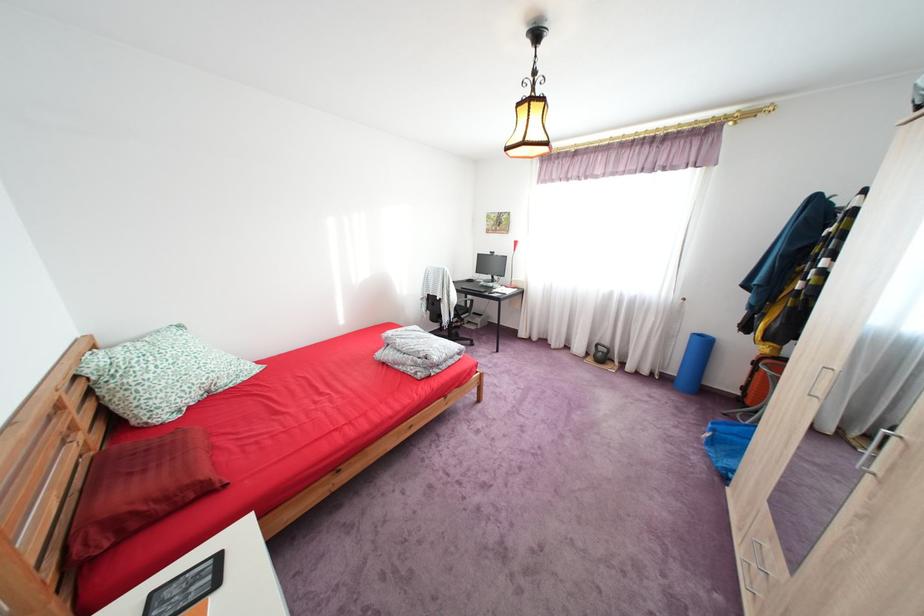
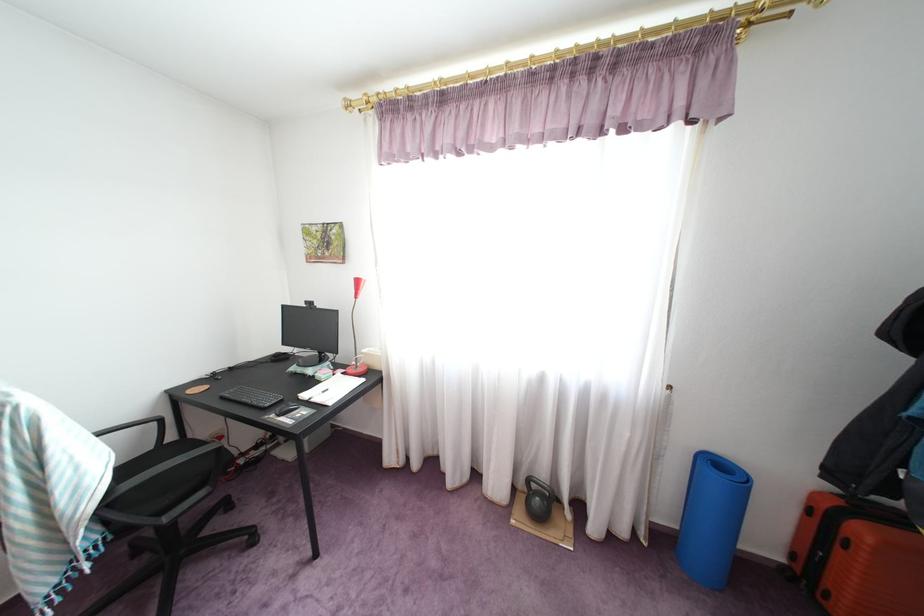
What movement of the cameraman would produce the second image?

The cameraman moved toward right, forward.